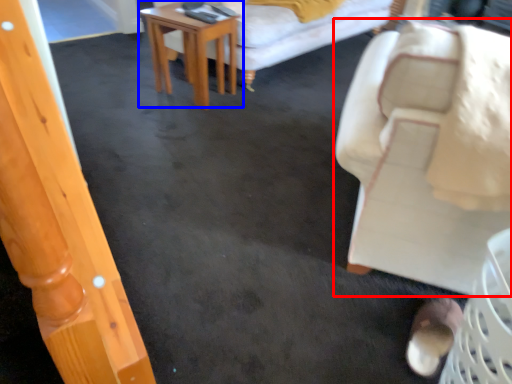
Question: Which point is closer to the camera, chair (highlighted by a red box) or table (highlighted by a blue box)?

Choices:
 (A) chair
 (B) table

Answer: (A)